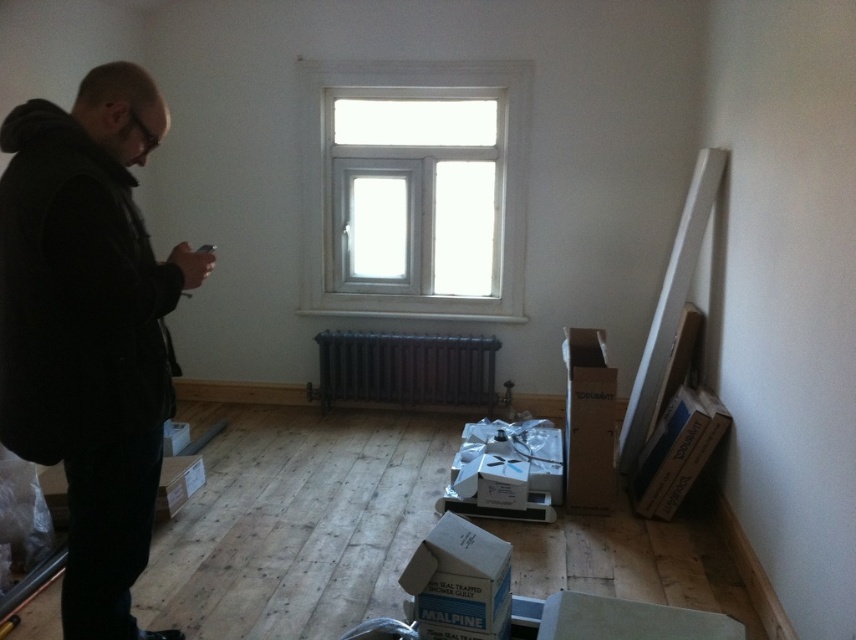
Which is more to the right, white plastic window at upper center or brown cardboard box at lower right?

Positioned to the right is brown cardboard box at lower right.

Does white plastic window at upper center have a greater height compared to brown cardboard box at lower right?

Yes.

Find the location of a particular element. The image size is (856, 640). white plastic window at upper center is located at coordinates (414, 188).

Does black matte jacket at left appear over brown cardboard box at lower right?

Yes, black matte jacket at left is above brown cardboard box at lower right.

Does black matte jacket at left lie in front of brown cardboard box at lower right?

Yes.

Where is `black matte jacket at left`? The image size is (856, 640). black matte jacket at left is located at coordinates (90, 330).

Does blue cardboard box at lower center have a greater height compared to white cardboard box at lower left?

Yes, blue cardboard box at lower center is taller than white cardboard box at lower left.

Looking at this image, how far apart are blue cardboard box at lower center and white cardboard box at lower left?

5.18 feet

Where is `blue cardboard box at lower center`? The width and height of the screenshot is (856, 640). blue cardboard box at lower center is located at coordinates (461, 579).